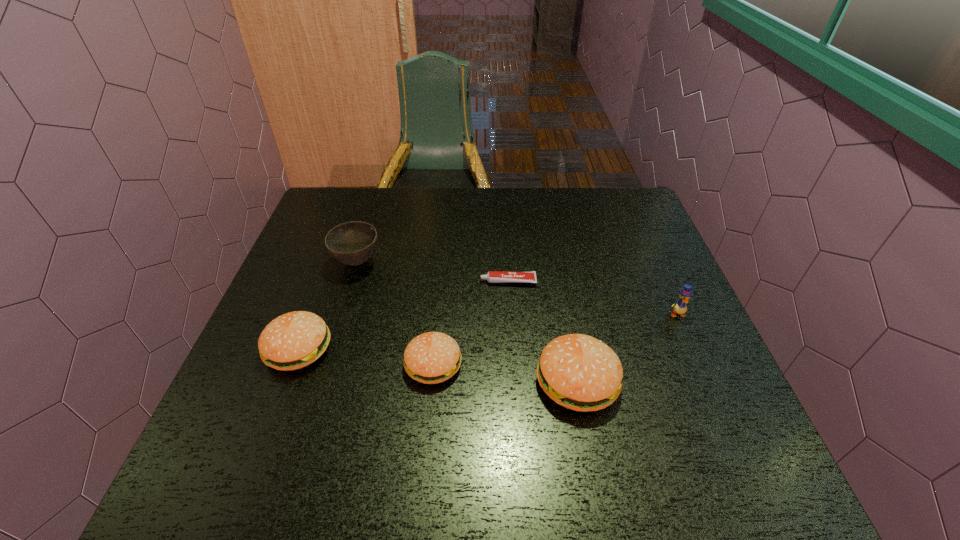
Find the location of a particular element. This screenshot has height=540, width=960. the second shortest patty is located at coordinates (294, 340).

Locate an element on the screen. The image size is (960, 540). the third shortest object is located at coordinates (294, 340).

Locate an element on the screen. This screenshot has height=540, width=960. the second shortest object is located at coordinates (433, 357).

Locate an element on the screen. the shortest patty is located at coordinates (433, 357).

At what (x,y) coordinates should I click in order to perform the action: click on the rightmost patty. Please return your answer as a coordinate pair (x, y). Looking at the image, I should click on (579, 372).

Locate an element on the screen. the fourth nearest object is located at coordinates (679, 307).

At what (x,y) coordinates should I click in order to perform the action: click on the rightmost object. Please return your answer as a coordinate pair (x, y). The width and height of the screenshot is (960, 540). Looking at the image, I should click on (679, 307).

Where is `bowl`? Image resolution: width=960 pixels, height=540 pixels. bowl is located at coordinates (352, 243).

Where is `the shortest object`? the shortest object is located at coordinates (492, 276).

In order to click on free space located on the back of the second tallest patty in this screenshot , I will do `click(332, 258)`.